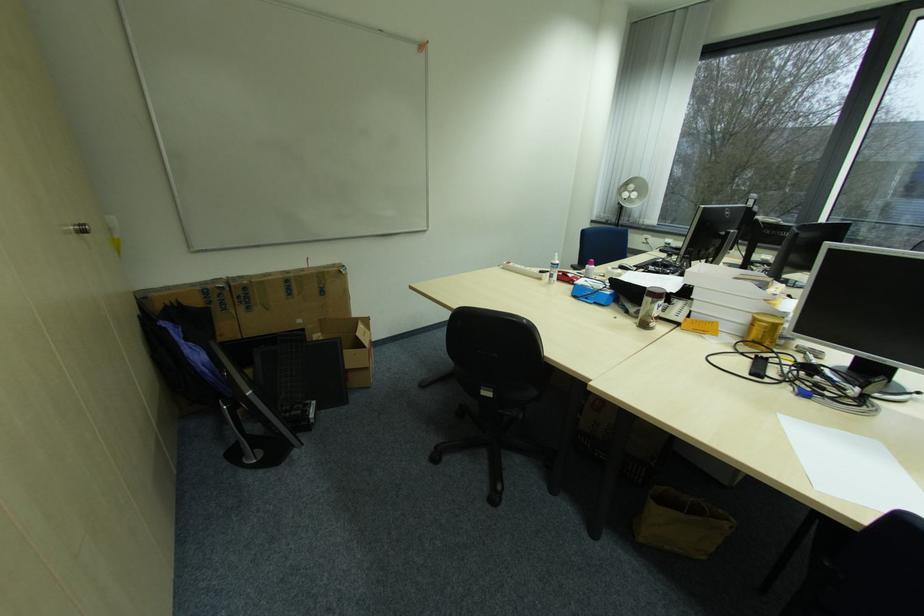
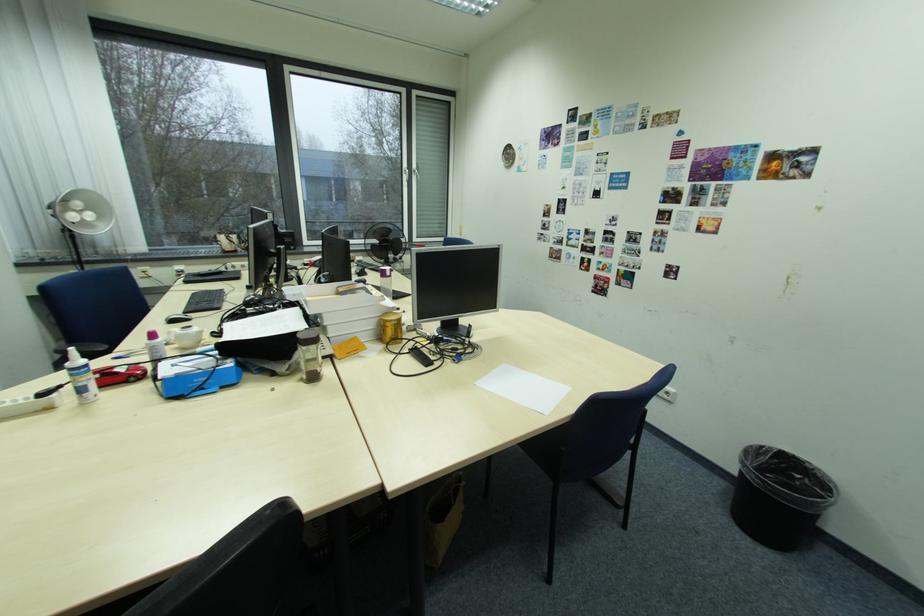
Find the pixel in the second image that matches the point at 643,323 in the first image.

(310, 381)